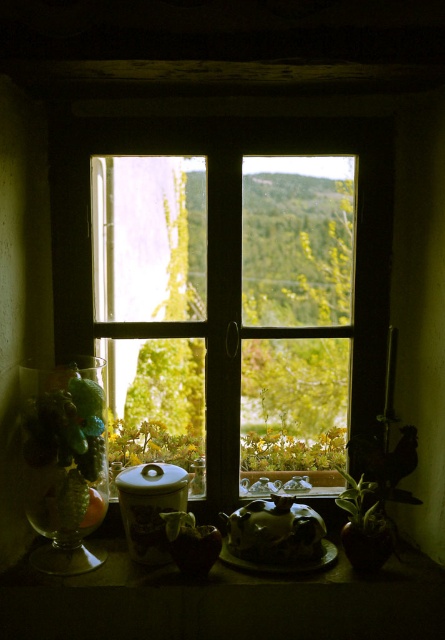
You are a delivery person who needs to place a small package between the wooden window at center and the matte ceramic teapot at center. Can you fit the package if it measures 16 inches long?

The distance between the wooden window at center and the matte ceramic teapot at center is 16.67 inches. Since the package is 16 inches long, it can fit within the space as it is slightly shorter than the available distance.

You are arranging items on a windowsill and have a wooden window at center and a matte ceramic teapot at center. Which object should you move to the right to make space for a new decorative item that needs to be placed between them?

You should move the wooden window at center to the right since it is currently positioned to the left of the matte ceramic teapot at center, so shifting it right would create space between them for the new item.